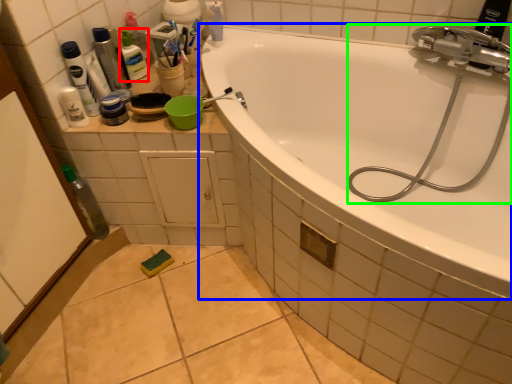
Question: Based on their relative distances, which object is nearer to toiletry (highlighted by a red box)? Choose from bathtub (highlighted by a blue box) and garden hose (highlighted by a green box).

Choices:
 (A) bathtub
 (B) garden hose

Answer: (A)